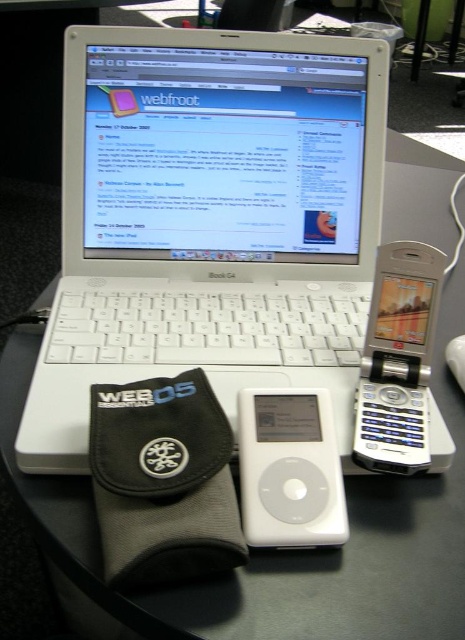
You are a developer working on a project and need to locate the white matte ipod at center in your workspace. Based on the coordinates provided, where exactly would you find it?

The white matte ipod at center is located at point (290, 468).

You are a photographer taking a picture of the workspace setup. You notice two points marked in the image at coordinates point (x=382, y=339) and point (x=451, y=358). Which point is closer to your camera lens?

Point (x=382, y=339) is closer to the viewer than point (x=451, y=358), so the point (x=382, y=339) is closer to the camera lens.

You are setting up a desk for a user who requires both a mouse and an iPod within easy reach. The user has specified that the distance between the two devices must be exactly 8.57 inches. Given the placement of the white matte ipod at center and the white plastic mouse at lower right in the scene, can you confirm if their current separation meets the user requirement?

The white matte ipod at center and white plastic mouse at lower right are 8.57 inches apart, so their current separation exactly meets the user requirement of 8.57 inches.